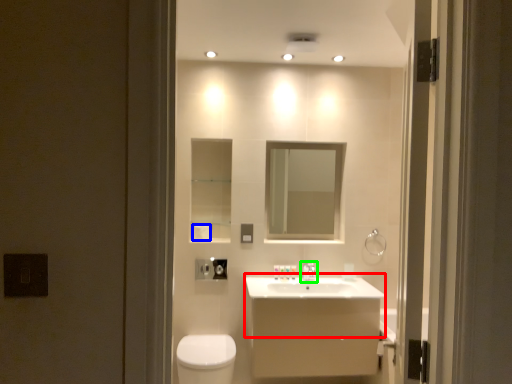
Question: Estimate the real-world distances between objects in this image. Which object is farther from counter top (highlighted by a red box), toilet paper (highlighted by a blue box) or tap (highlighted by a green box)?

Choices:
 (A) toilet paper
 (B) tap

Answer: (A)